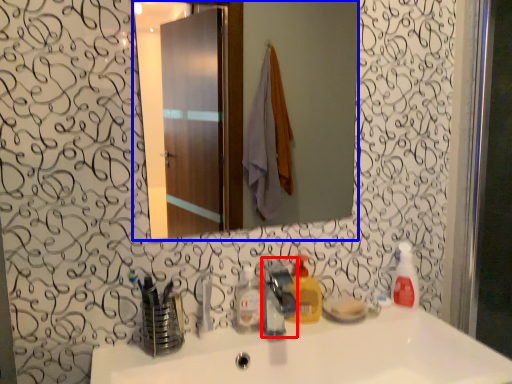
Question: Among these objects, which one is nearest to the camera, faucet (highlighted by a red box) or mirror (highlighted by a blue box)?

Choices:
 (A) faucet
 (B) mirror

Answer: (A)